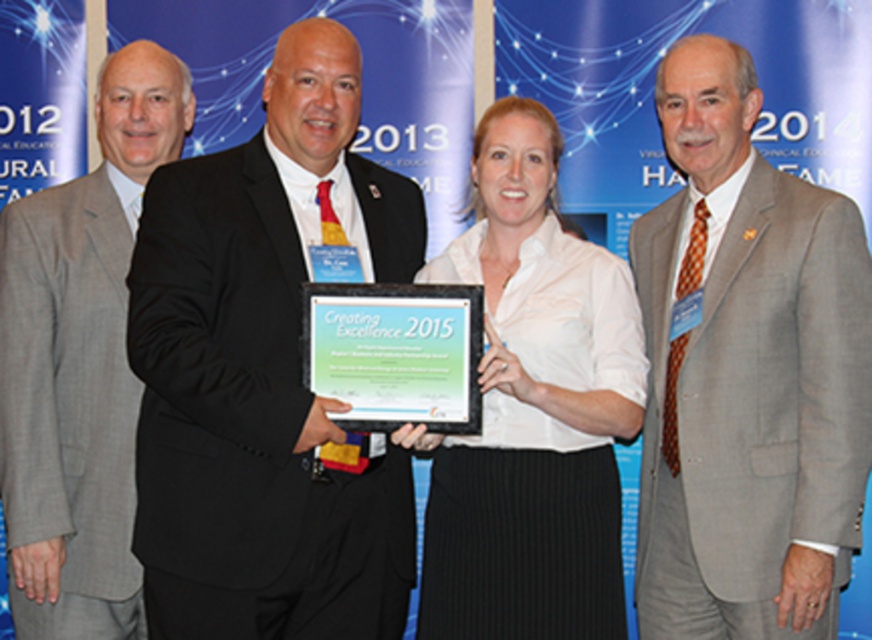
Based on the scene description, which individual is positioned higher between the black suit at center and the gray wool suit at center?

The black suit at center is positioned higher than the gray wool suit at center according to the description.

You are standing at the origin of the coordinate system in the image. Which of the two points, point (591, 456) or point (428, 326), is farther from you?

Point (591, 456) is farther from you because it is behind point (428, 326).